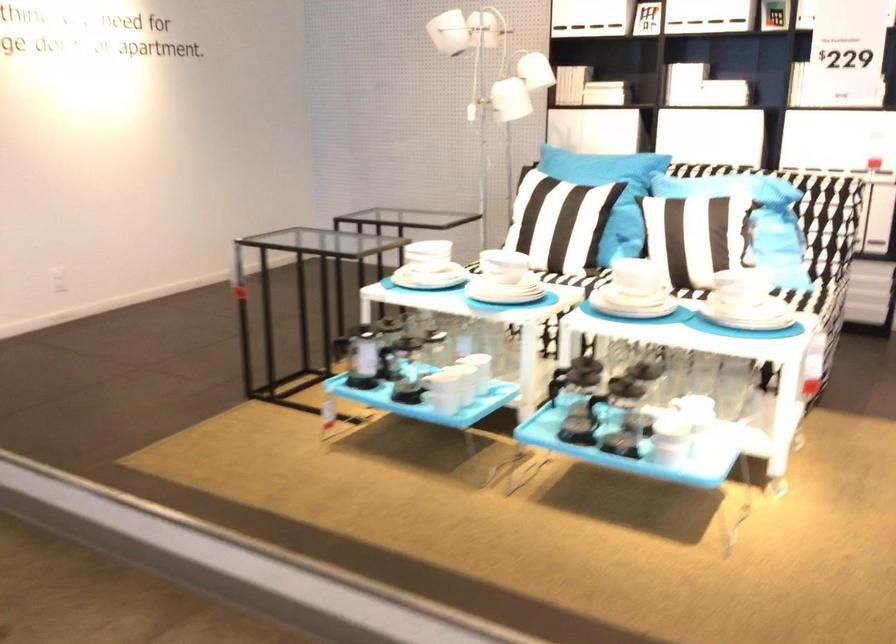
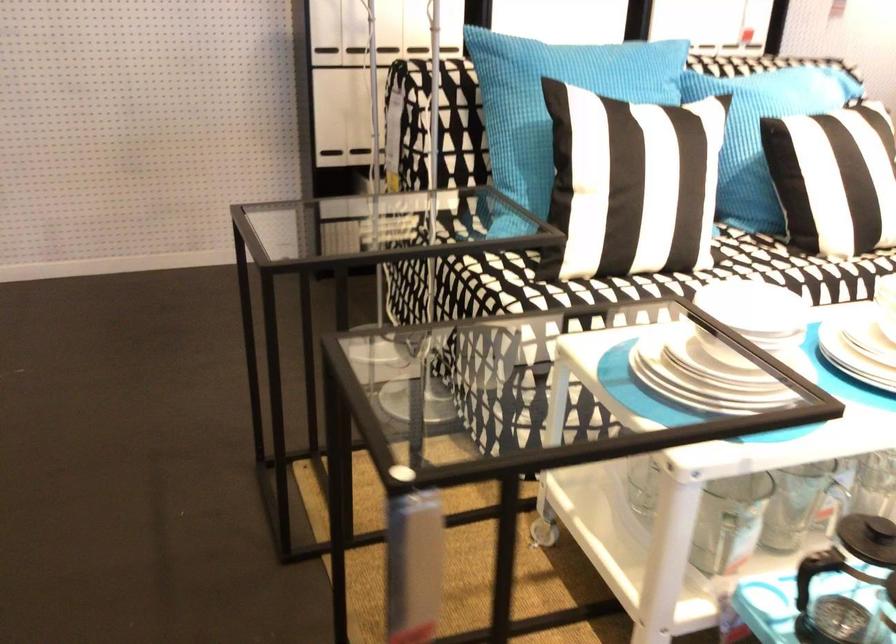
Where in the second image is the point corresponding to [421,272] from the first image?

(709, 373)